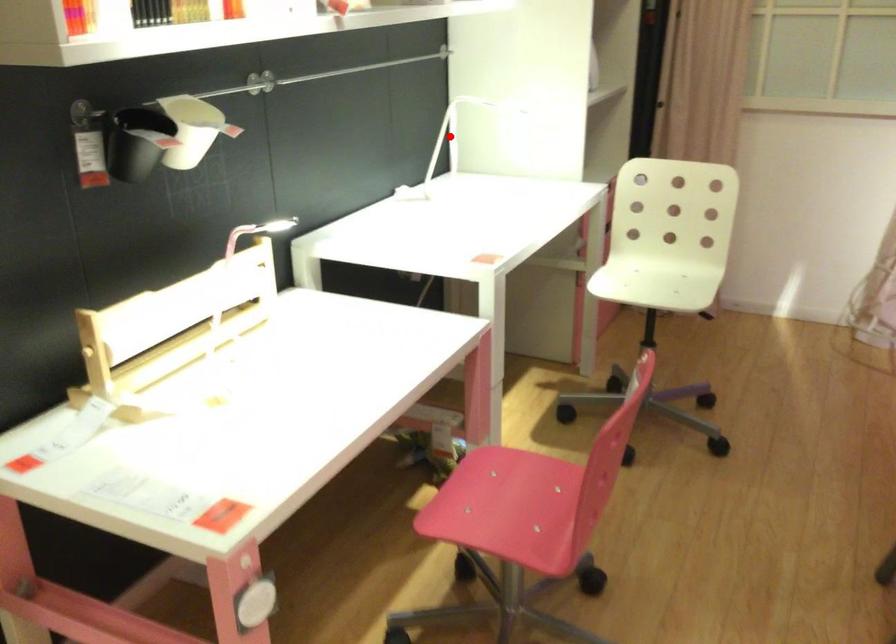
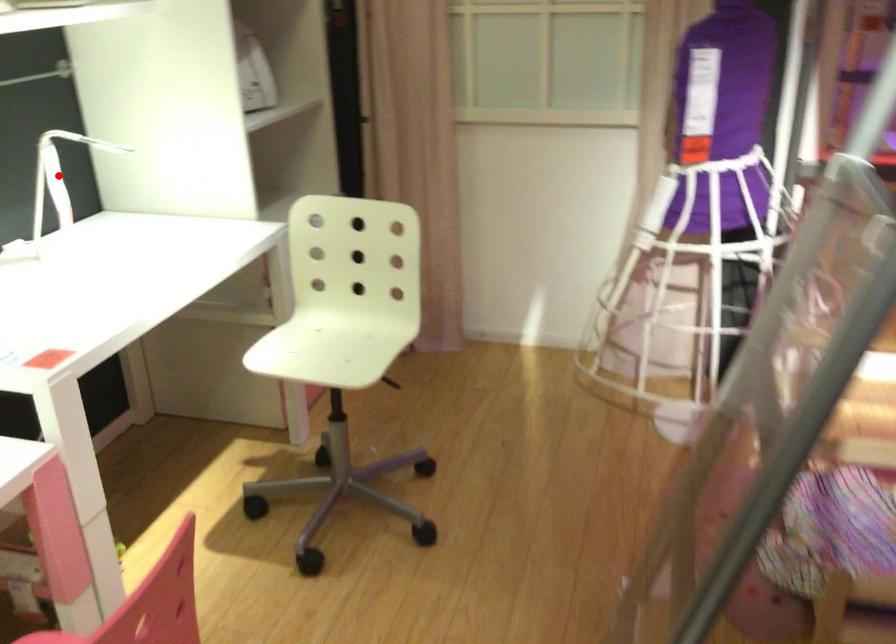
I am providing you with two images of the same scene from different viewpoints. A red point is marked on the first image and another point is marked on the second image. Does the point marked in image1 correspond to the same location as the one in image2?

Yes